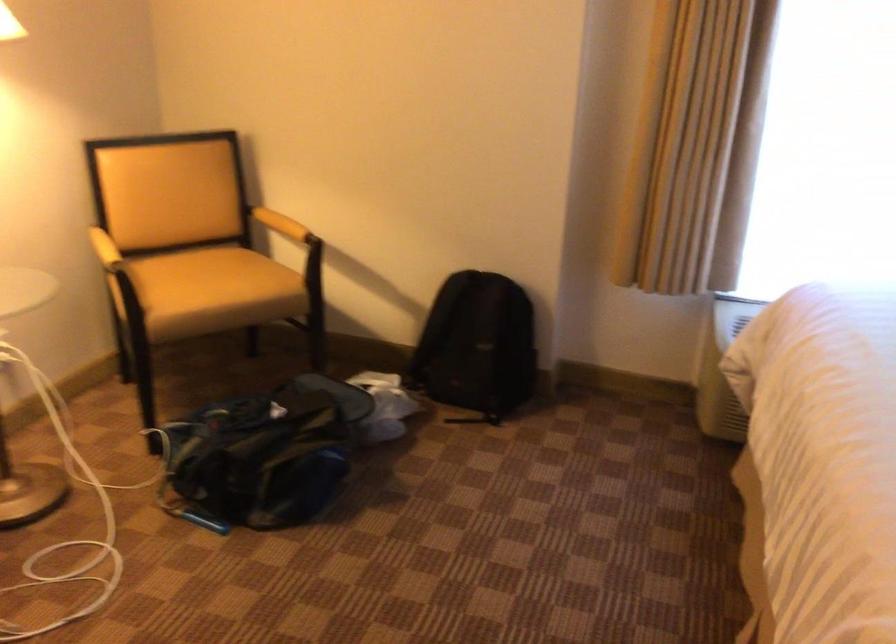
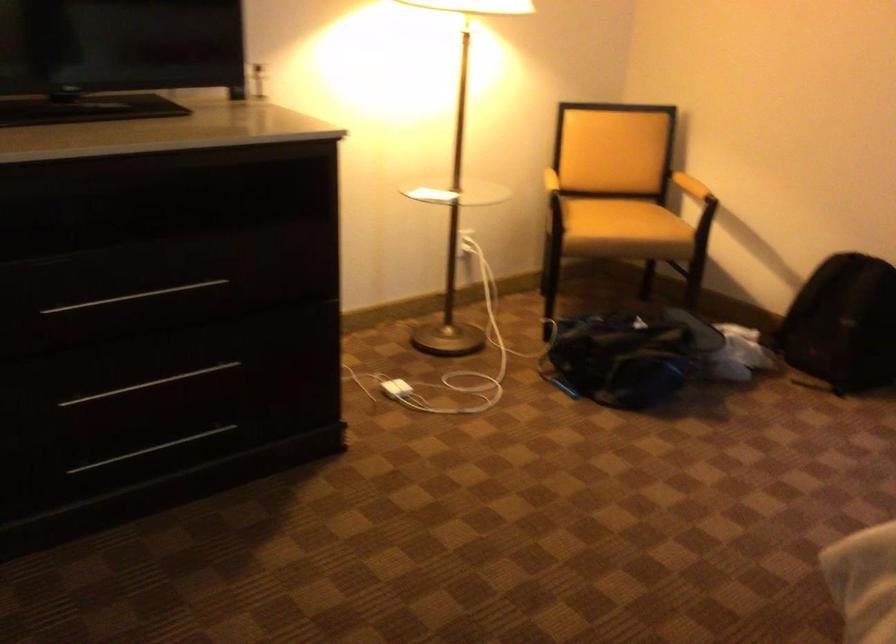
Where in the second image is the point corresponding to pixel 281 457 from the first image?

(627, 355)